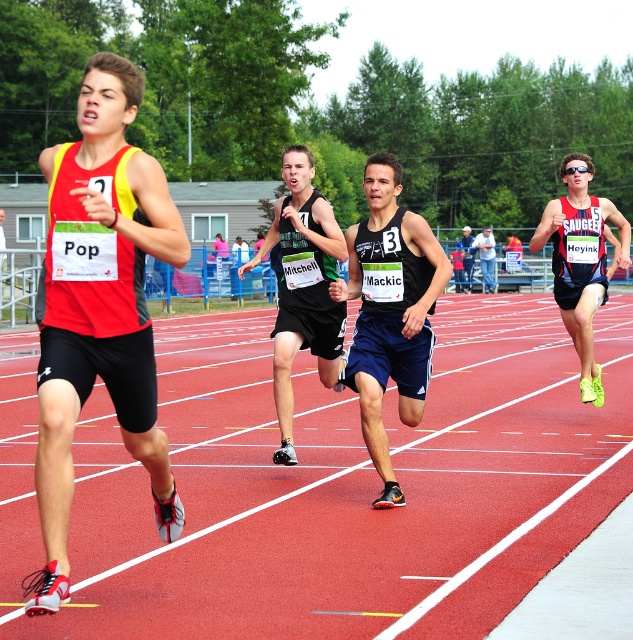
Is rubberized red track at center wider than matte black tank top at center?

Yes.

Between rubberized red track at center and matte black tank top at center, which one is positioned lower?

rubberized red track at center

Where is `rubberized red track at center`? The height and width of the screenshot is (640, 633). rubberized red track at center is located at coordinates (335, 486).

From the picture: Can you confirm if matte red tank top at left is positioned above neon green running shoe at right?

Actually, matte red tank top at left is below neon green running shoe at right.

Is matte red tank top at left bigger than neon green running shoe at right?

No, matte red tank top at left is not bigger than neon green running shoe at right.

Find the location of a particular element. This screenshot has width=633, height=640. matte red tank top at left is located at coordinates (99, 307).

Who is positioned more to the right, black matte tank top at center or denim jacket at center?

From the viewer's perspective, denim jacket at center appears more on the right side.

Between point (384, 465) and point (487, 252), which one is positioned in front?

Positioned in front is point (384, 465).

Where is `black matte tank top at center`? black matte tank top at center is located at coordinates (389, 310).